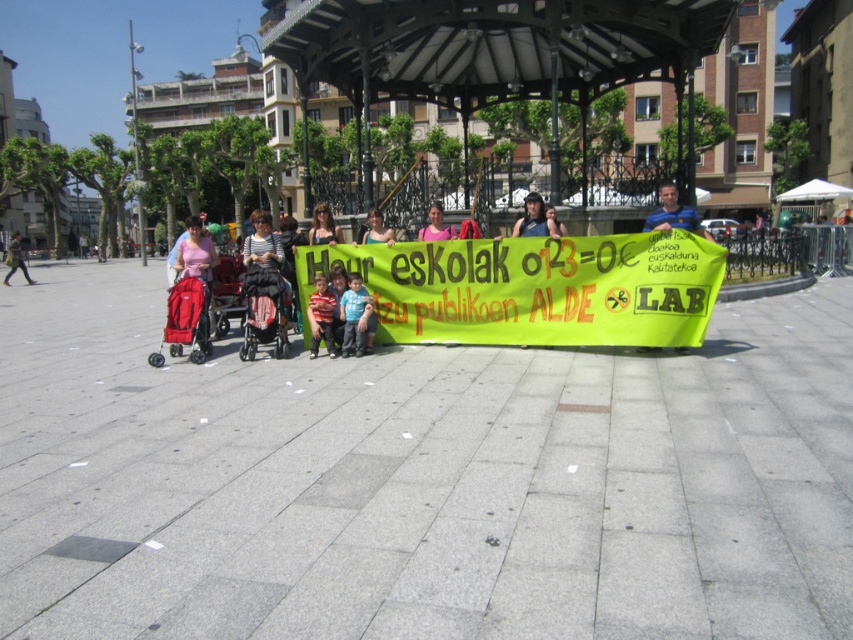
Is the position of green fabric shirt at center more distant than that of matte black stroller at left?

No, green fabric shirt at center is closer to the viewer.

Between point (373, 218) and point (18, 248), which one is positioned behind?

The point (18, 248) is more distant.

What do you see at coordinates (376, 228) in the screenshot? I see `green fabric shirt at center` at bounding box center [376, 228].

Locate an element on the screen. green fabric shirt at center is located at coordinates (376, 228).

Is point (189, 332) farther from viewer compared to point (317, 236)?

No, (189, 332) is closer to viewer.

Does matte red stroller at left have a larger size compared to matte black shirt at center?

Yes.

Does point (206, 310) come behind point (335, 227)?

No, (206, 310) is closer to viewer.

I want to click on matte red stroller at left, so click(187, 317).

Is green fabric banner at center thinner than matte black shirt at center?

Incorrect, green fabric banner at center's width is not less than matte black shirt at center's.

Between green fabric banner at center and matte black shirt at center, which one has more height?

With more height is green fabric banner at center.

Is point (691, 248) positioned before point (315, 218)?

Yes, it is in front of point (315, 218).

Locate an element on the screen. green fabric banner at center is located at coordinates (534, 289).